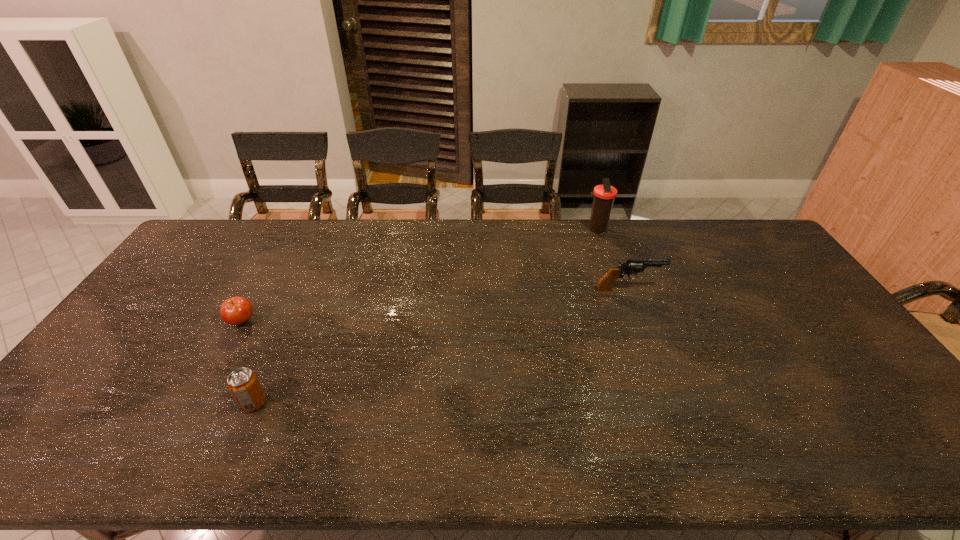
In order to click on free space located on the right of the soda can in this screenshot , I will do `click(320, 403)`.

Find the location of a particular element. The width and height of the screenshot is (960, 540). vacant area located on the front of the third farthest object is located at coordinates (198, 401).

Where is `object that is at the far edge`? The width and height of the screenshot is (960, 540). object that is at the far edge is located at coordinates (604, 195).

In the image, there is a desktop. Identify the location of vacant space at the far edge. The width and height of the screenshot is (960, 540). (490, 241).

Find the location of a particular element. The height and width of the screenshot is (540, 960). free space at the near edge of the desktop is located at coordinates (256, 453).

The width and height of the screenshot is (960, 540). In the image, there is a desktop. Identify the location of vacant area at the right edge. (788, 340).

What are the coordinates of `blank area at the far right corner` in the screenshot? It's located at (737, 241).

Identify the location of vacant area at the near right corner. (852, 432).

I want to click on unoccupied area between the thermos bottle and the third nearest object, so click(612, 260).

This screenshot has height=540, width=960. Identify the location of empty space that is in between the tallest object and the shortest object. (420, 275).